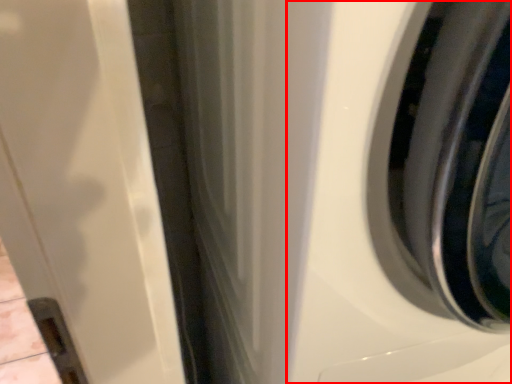
Question: From the image's perspective, what is the correct spatial positioning of washing machine (annotated by the red box) in reference to wheel?

Choices:
 (A) above
 (B) below

Answer: (B)